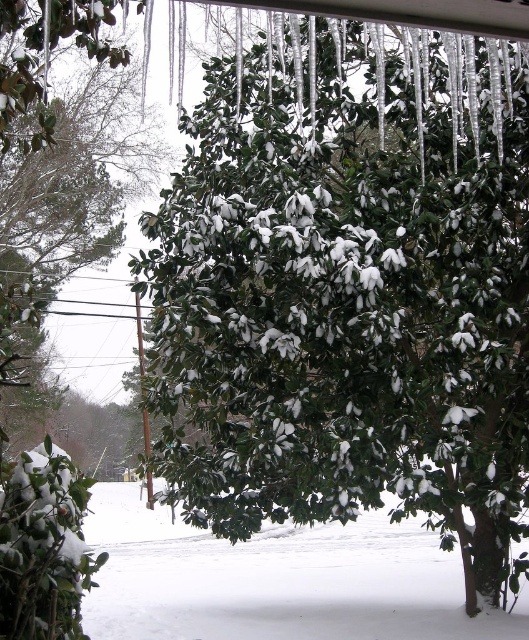
Is point (291, 348) farther from viewer compared to point (39, 296)?

No, (291, 348) is in front of (39, 296).

Between point (207, 412) and point (65, 184), which one is positioned behind?

Point (65, 184)

The height and width of the screenshot is (640, 529). In order to click on green matte tree at center in this screenshot , I will do `click(349, 291)`.